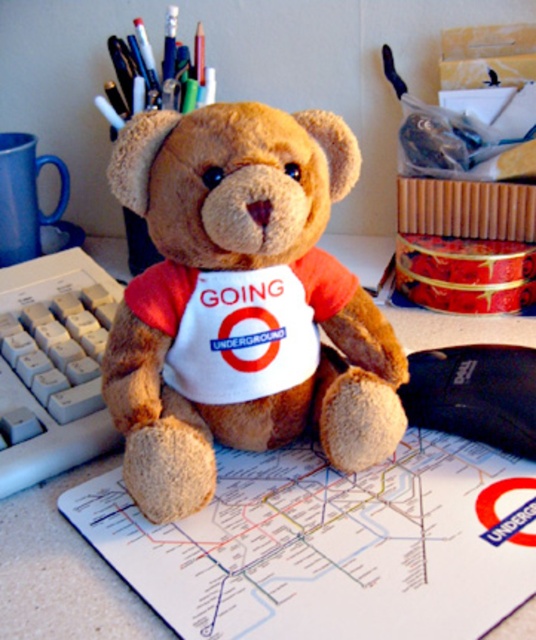
Does point (332, 387) come in front of point (67, 323)?

Yes.

This screenshot has width=536, height=640. What do you see at coordinates (241, 301) in the screenshot?
I see `soft brown teddy bear at center` at bounding box center [241, 301].

Is point (130, 381) farther from camera compared to point (44, 401)?

No, (130, 381) is in front of (44, 401).

The height and width of the screenshot is (640, 536). In order to click on soft brown teddy bear at center in this screenshot , I will do `click(241, 301)`.

Who is more forward, (332, 426) or (464, 353)?

Point (332, 426) is more forward.

Between soft brown teddy bear at center and black fabric mouse at center, which one is positioned higher?

Positioned higher is soft brown teddy bear at center.

Which is behind, point (318, 420) or point (442, 387)?

Point (442, 387)

Identify the location of soft brown teddy bear at center. Image resolution: width=536 pixels, height=640 pixels. (241, 301).

Which is below, white plastic keyboard at left or brown plush bear at center?

brown plush bear at center is lower down.

Who is more forward, (98, 381) or (107, 573)?

Point (107, 573) is in front.

You are a GUI agent. You are given a task and a screenshot of the screen. Output one action in this format:
    pyautogui.click(x=<x>, y=<y>)
    Task: Click on the white plastic keyboard at left
    
    Given the screenshot: What is the action you would take?
    pyautogui.click(x=53, y=365)